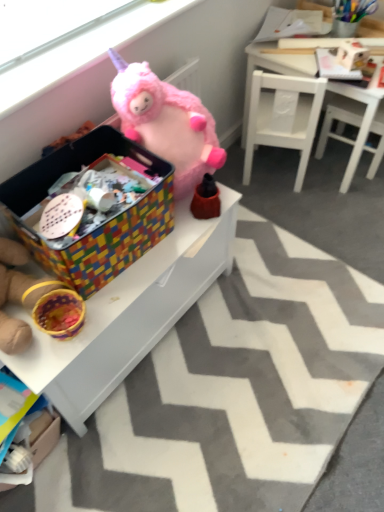
Where is `free point in front of white wooden table at upper right, the 2th table ordered from the bottom`? free point in front of white wooden table at upper right, the 2th table ordered from the bottom is located at coordinates (328, 214).